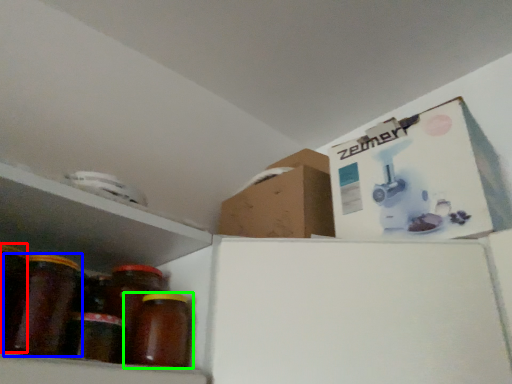
Question: Which object is the closest to the glass jar (highlighted by a red box)? Choose among these: bottle (highlighted by a blue box) or bottle (highlighted by a green box).

Choices:
 (A) bottle
 (B) bottle

Answer: (A)